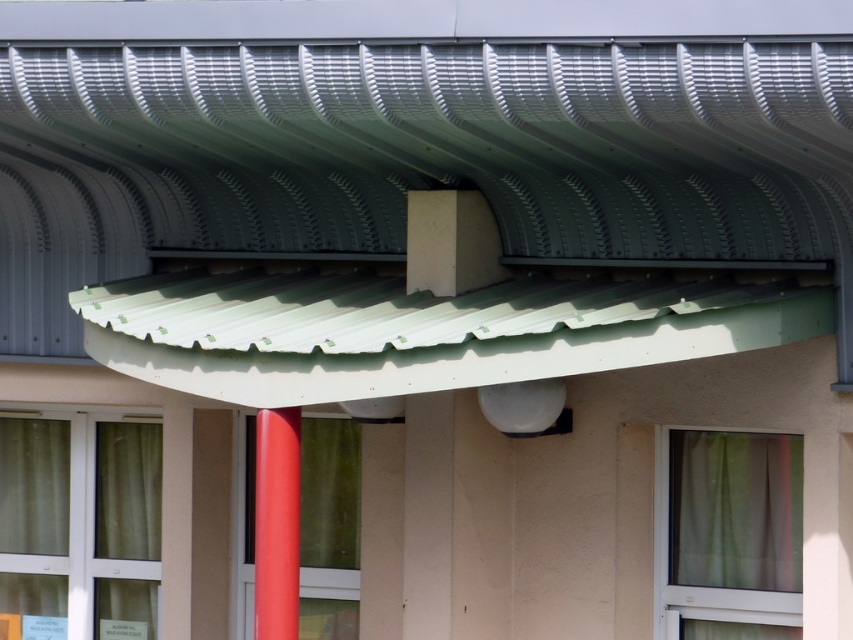
Question: Which of the following is the farthest from the observer?

Choices:
 (A) (738, 497)
 (B) (276, 500)
 (C) (148, 611)

Answer: (C)

Question: Which is nearer to the green fabric curtain at lower left?

Choices:
 (A) glossy red pole at center
 (B) green sheer curtain at lower right

Answer: (B)

Question: Where is green sheer curtain at lower right located in relation to glossy red pole at center in the image?

Choices:
 (A) right
 (B) left

Answer: (A)

Question: Does green sheer curtain at lower right have a smaller size compared to glossy red pole at center?

Choices:
 (A) no
 (B) yes

Answer: (A)

Question: Which object appears farthest from the camera in this image?

Choices:
 (A) glossy red pole at center
 (B) green fabric curtain at lower left
 (C) green sheer curtain at lower right

Answer: (B)

Question: Does green fabric curtain at lower left have a larger size compared to glossy red pole at center?

Choices:
 (A) no
 (B) yes

Answer: (B)